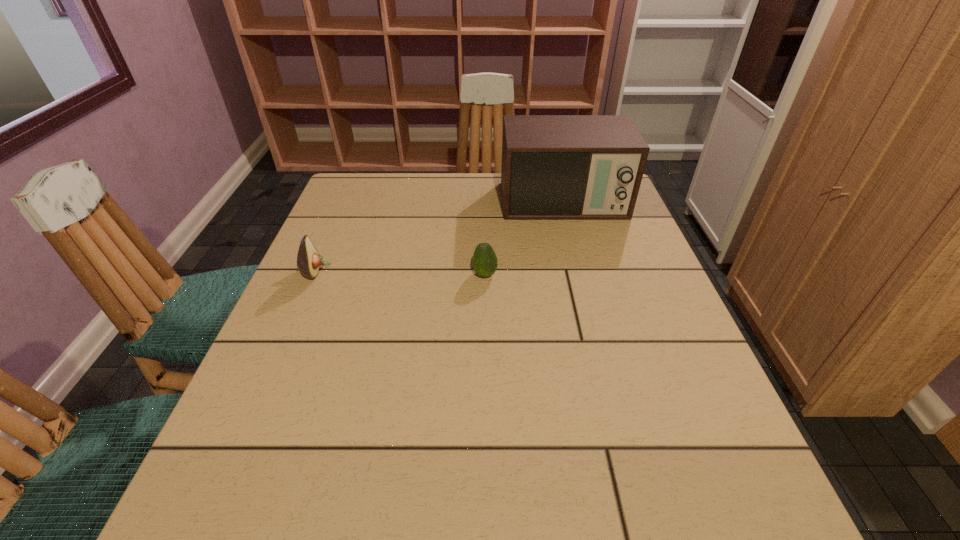
You are a GUI agent. You are given a task and a screenshot of the screen. Output one action in this format:
    pyautogui.click(x=<x>, y=<y>)
    Task: Click on the rightmost object
    
    Given the screenshot: What is the action you would take?
    pyautogui.click(x=554, y=167)

This screenshot has height=540, width=960. I want to click on radio receiver, so (554, 167).

Find the location of `the taller avocado`. the taller avocado is located at coordinates [308, 260].

Find the location of a particular element. The height and width of the screenshot is (540, 960). the left avocado is located at coordinates 308,260.

Identify the location of the shorter avocado. (x=484, y=260).

Where is `the right avocado`? The image size is (960, 540). the right avocado is located at coordinates (484, 260).

You are a GUI agent. You are given a task and a screenshot of the screen. Output one action in this format:
    pyautogui.click(x=<x>, y=<y>)
    Task: Click on the free spot located 0.260m on the front-facing side of the rightmost object
    
    Given the screenshot: What is the action you would take?
    pyautogui.click(x=588, y=294)

Locate an element on the screen. blank area located on the seed side of the taller avocado is located at coordinates (391, 271).

Locate an element on the screen. This screenshot has width=960, height=540. vacant area situated on the right of the second object from left to right is located at coordinates (555, 275).

Image resolution: width=960 pixels, height=540 pixels. I want to click on object that is positioned at the far edge, so click(x=554, y=167).